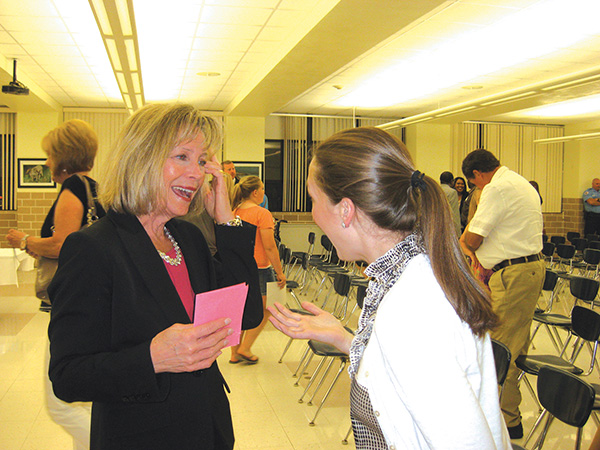
At what (x,y) coordinates should I click in order to perform the action: click on white tablecloth. Please return your answer as a coordinate pair (x, y). This screenshot has height=450, width=600. Looking at the image, I should click on pyautogui.click(x=9, y=270).